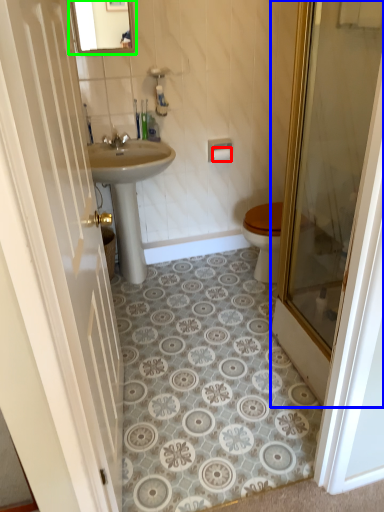
Question: Based on their relative distances, which object is nearer to toilet paper (highlighted by a red box)? Choose from door (highlighted by a blue box) and mirror (highlighted by a green box).

Choices:
 (A) door
 (B) mirror

Answer: (B)